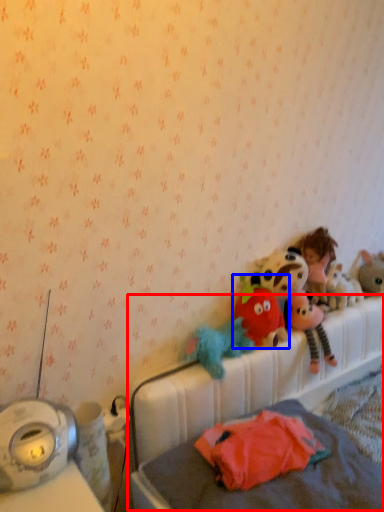
Question: Which point is further to the camera, hospital bed (highlighted by a red box) or toy (highlighted by a blue box)?

Choices:
 (A) hospital bed
 (B) toy

Answer: (B)